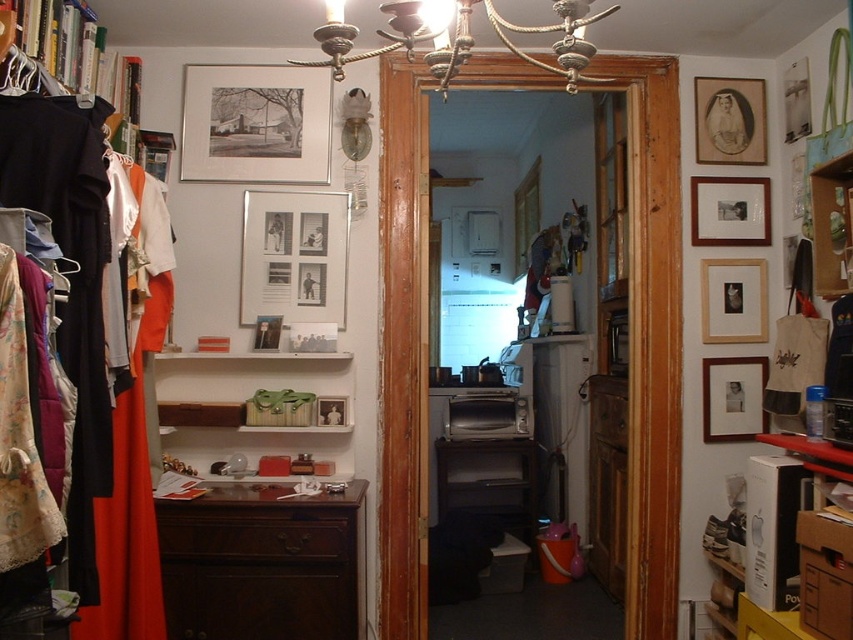
Question: Does white glossy shelf at center appear on the left side of wooden photo frame at right?

Choices:
 (A) yes
 (B) no

Answer: (A)

Question: Which point is closer to the camera?

Choices:
 (A) dark wood dresser at lower left
 (B) matte white picture frame at center
 (C) wooden photo frame at right
 (D) matte silver picture frame at upper center

Answer: (A)

Question: Which object is the closest to the matte wooden picture frame at center?

Choices:
 (A) metallic chandelier at upper center
 (B) white glossy shelf at center

Answer: (B)

Question: Can you confirm if white glossy shelf at center is positioned to the left of matte white picture frame at center?

Choices:
 (A) yes
 (B) no

Answer: (A)

Question: Does matte black clothes at left have a lesser width compared to matte black portrait at upper right?

Choices:
 (A) yes
 (B) no

Answer: (B)

Question: Which is farther from the matte black portrait at upper right?

Choices:
 (A) matte black clothes at left
 (B) metallic chandelier at upper center
 (C) matte wooden picture frame at center

Answer: (A)